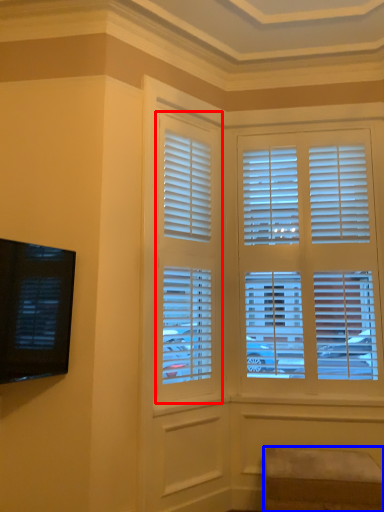
Question: Which point is closer to the camera, window (highlighted by a red box) or furniture (highlighted by a blue box)?

Choices:
 (A) window
 (B) furniture

Answer: (B)